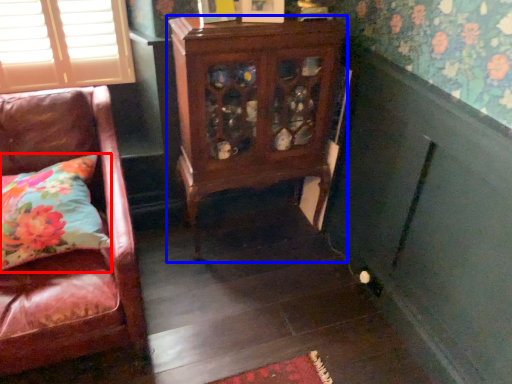
Question: Which point is closer to the camera, pillow (highlighted by a red box) or furniture (highlighted by a blue box)?

Choices:
 (A) pillow
 (B) furniture

Answer: (A)